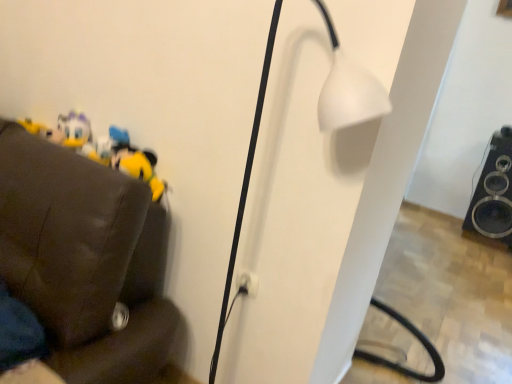
The width and height of the screenshot is (512, 384). Identify the location of white matte lamp at center. (348, 89).

You are a GUI agent. You are given a task and a screenshot of the screen. Output one action in this format:
    pyautogui.click(x=<x>, y=<y>)
    Task: Click on the black glossy speaker at lower right
    Image resolution: width=512 pixels, height=384 pixels.
    Given the screenshot: What is the action you would take?
    pyautogui.click(x=494, y=192)

Find the location of a particular element. The height and width of the screenshot is (384, 512). yellow plush toy at left is located at coordinates (140, 168).

The height and width of the screenshot is (384, 512). Describe the element at coordinates (140, 168) in the screenshot. I see `yellow plush toy at left` at that location.

Identify the location of white matte lamp at center. (348, 89).

Locate an element on the screen. electric outlet in front of the yellow plush toy at left is located at coordinates (247, 284).

Would you say white plastic electric outlet at center contains yellow plush toy at left?

Actually, yellow plush toy at left is outside white plastic electric outlet at center.

Considering the sizes of white plastic electric outlet at center and yellow plush toy at left in the image, is white plastic electric outlet at center wider or thinner than yellow plush toy at left?

white plastic electric outlet at center is thinner than yellow plush toy at left.

Does white plastic electric outlet at center have a larger size compared to yellow plush toy at left?

No.

In the scene shown: From a real-world perspective, is white matte lamp at center on black glossy speaker at lower right?

Yes.

Is white matte lamp at center far away from black glossy speaker at lower right?

white matte lamp at center is far away from black glossy speaker at lower right.

In the scene shown: Does white matte lamp at center have a greater width compared to black glossy speaker at lower right?

No, white matte lamp at center is not wider than black glossy speaker at lower right.

Which object is positioned more to the right, white matte lamp at center or black glossy speaker at lower right?

black glossy speaker at lower right is more to the right.

Is black glossy speaker at lower right taller than white matte lamp at center?

No.

Which of these two, black glossy speaker at lower right or white matte lamp at center, is bigger?

black glossy speaker at lower right.

From the image's perspective, is black glossy speaker at lower right positioned above or below white matte lamp at center?

Clearly, from the image's perspective, black glossy speaker at lower right is above white matte lamp at center.

How many degrees apart are the facing directions of yellow plush toy at left and white matte lamp at center?

The angle between the facing direction of yellow plush toy at left and the facing direction of white matte lamp at center is 0.959 degrees.

Looking at this image, is yellow plush toy at left facing away from white matte lamp at center?

No, yellow plush toy at left is not facing away from white matte lamp at center.

Considering the sizes of objects yellow plush toy at left and white matte lamp at center in the image provided, who is thinner, yellow plush toy at left or white matte lamp at center?

yellow plush toy at left.

Is yellow plush toy at left at the right side of black glossy speaker at lower right?

Incorrect, yellow plush toy at left is not on the right side of black glossy speaker at lower right.

What's the angular difference between yellow plush toy at left and black glossy speaker at lower right's facing directions?

The facing directions of yellow plush toy at left and black glossy speaker at lower right are 0.709 degrees apart.

From the image's perspective, which is above, yellow plush toy at left or black glossy speaker at lower right?

yellow plush toy at left.

Which is in front, point (133, 160) or point (504, 239)?

The point (133, 160) is in front.

Is there a large distance between white plastic electric outlet at center and black glossy speaker at lower right?

Yes, white plastic electric outlet at center is far from black glossy speaker at lower right.

In the scene shown: What's the angular difference between white plastic electric outlet at center and black glossy speaker at lower right's facing directions?

The angle between the facing direction of white plastic electric outlet at center and the facing direction of black glossy speaker at lower right is 2.1 degrees.

Is white plastic electric outlet at center looking in the opposite direction of black glossy speaker at lower right?

Absolutely, white plastic electric outlet at center is directed away from black glossy speaker at lower right.

I want to click on electric outlet below the black glossy speaker at lower right (from the image's perspective), so click(247, 284).

From the picture: From the image's perspective, which object appears higher, white matte lamp at center or yellow plush toy at left?

yellow plush toy at left appears higher in the image.

In the image, there is a yellow plush toy at left. At what (x,y) coordinates should I click in order to perform the action: click on lamp below it (from a real-world perspective). Please return your answer as a coordinate pair (x, y). Looking at the image, I should click on (348, 89).

Considering the relative positions of white matte lamp at center and yellow plush toy at left in the image provided, is white matte lamp at center to the right of yellow plush toy at left from the viewer's perspective?

Yes.

The image size is (512, 384). What are the coordinates of `electric outlet that is below the yellow plush toy at left (from the image's perspective)` in the screenshot? It's located at (247, 284).

At what (x,y) coordinates should I click in order to perform the action: click on speaker on the right side of white matte lamp at center. Please return your answer as a coordinate pair (x, y). The height and width of the screenshot is (384, 512). Looking at the image, I should click on (494, 192).

Considering their positions, is white matte lamp at center positioned further to yellow plush toy at left than white plastic electric outlet at center?

Among the two, white matte lamp at center is located further to yellow plush toy at left.

In the scene shown: Considering their positions, is white plastic electric outlet at center positioned further to white matte lamp at center than black glossy speaker at lower right?

The object further to white matte lamp at center is black glossy speaker at lower right.

From the image, which object appears to be nearer to black glossy speaker at lower right, white matte lamp at center or yellow plush toy at left?

white matte lamp at center.

Estimate the real-world distances between objects in this image. Which object is closer to white plastic electric outlet at center, white matte lamp at center or black glossy speaker at lower right?

white matte lamp at center is closer to white plastic electric outlet at center.

Looking at the image, which one is located further to white plastic electric outlet at center, white matte lamp at center or yellow plush toy at left?

Among the two, yellow plush toy at left is located further to white plastic electric outlet at center.

In the scene shown: Considering their positions, is yellow plush toy at left positioned further to white matte lamp at center than black glossy speaker at lower right?

The object further to white matte lamp at center is black glossy speaker at lower right.

Estimate the real-world distances between objects in this image. Which object is further from white matte lamp at center, black glossy speaker at lower right or white plastic electric outlet at center?

black glossy speaker at lower right lies further to white matte lamp at center than the other object.

Which object lies nearer to the anchor point yellow plush toy at left, black glossy speaker at lower right or white plastic electric outlet at center?

white plastic electric outlet at center.

Identify the location of electric outlet between white matte lamp at center and yellow plush toy at left in the front-back direction. This screenshot has height=384, width=512. (247, 284).

Find the location of a particular element. This screenshot has height=384, width=512. lamp situated between yellow plush toy at left and black glossy speaker at lower right from left to right is located at coordinates (348, 89).

Identify the location of electric outlet positioned between white matte lamp at center and black glossy speaker at lower right from near to far. (247, 284).

In order to click on electric outlet located between yellow plush toy at left and black glossy speaker at lower right in the left-right direction in this screenshot , I will do `click(247, 284)`.